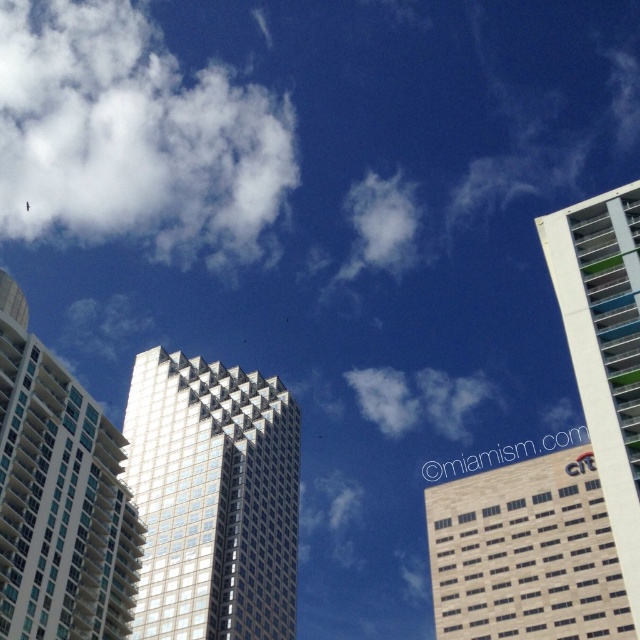
Question: Is white glass building at center smaller than beige brick building at center?

Choices:
 (A) yes
 (B) no

Answer: (A)

Question: Which object appears farthest from the camera in this image?

Choices:
 (A) white fluffy cloud at upper left
 (B) white fluffy cloud at upper center

Answer: (A)

Question: Estimate the real-world distances between objects in this image. Which object is farther from the white fluffy cloud at upper left?

Choices:
 (A) beige brick building at center
 (B) white glass building at upper right

Answer: (B)

Question: Can you confirm if white fluffy cloud at upper left is smaller than white fluffy cloud at upper center?

Choices:
 (A) no
 (B) yes

Answer: (A)

Question: From the image, what is the correct spatial relationship of white fluffy cloud at upper left in relation to metallic glass skyscraper at center?

Choices:
 (A) right
 (B) left

Answer: (B)

Question: Which point is closer to the camera?

Choices:
 (A) (26, 125)
 (B) (465, 518)
 (C) (22, 605)
 (D) (369, 416)

Answer: (C)